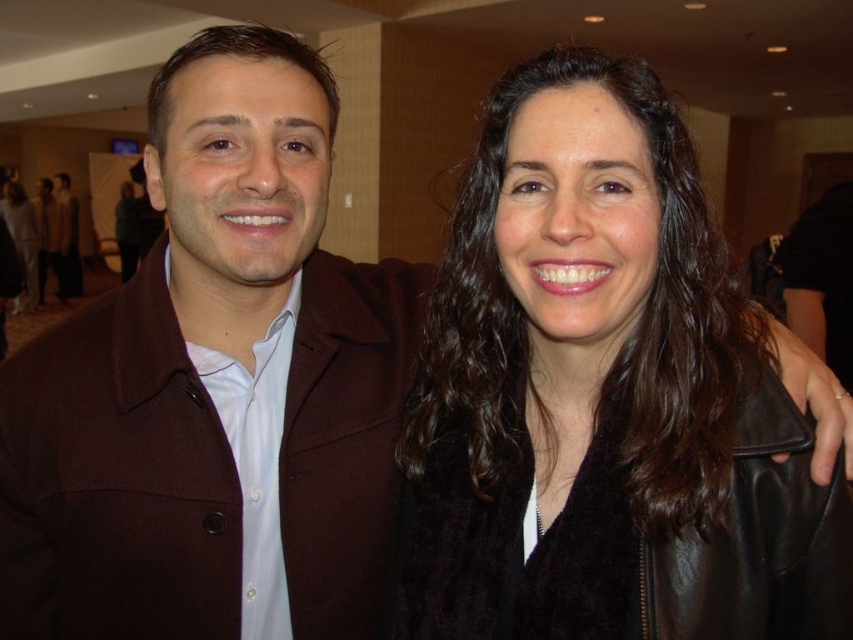
You are a fashion designer observing the scene. You need to determine which of the two jackets, the black leather jacket at center or the matte brown coat at center, would require more fabric to make based on their length. Which one would need more fabric?

The matte brown coat at center would require more fabric because it is longer than the black leather jacket at center.

You are organizing a coat rack for guests at an event. You have a black leather jacket at center and a matte brown coat at center. If the coat rack has a limited space that can only accommodate one of them, which coat should you choose to fit properly?

The black leather jacket at center is smaller than the matte brown coat at center, so you should choose the black leather jacket at center to fit properly in the limited space.